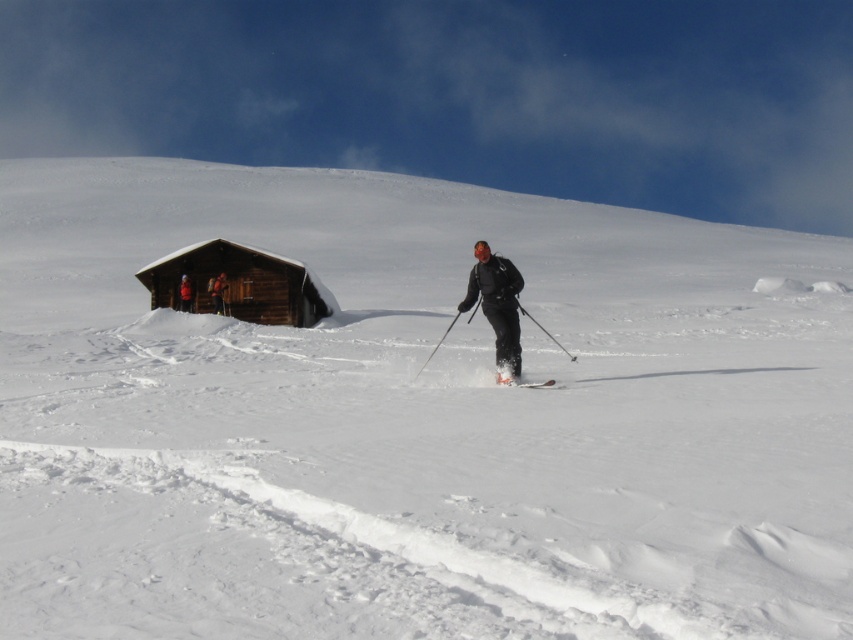
Is point (218, 300) positioned after point (186, 298)?

No, (218, 300) is in front of (186, 298).

Between point (213, 300) and point (183, 294), which one is positioned in front?

Positioned in front is point (183, 294).

Identify the location of orange fabric jacket at left. [218, 291].

Who is positioned more to the left, brown wooden log cabin at upper left or orange fabric jacket at left?

Positioned to the left is brown wooden log cabin at upper left.

Does brown wooden log cabin at upper left lie behind orange fabric jacket at left?

Yes, it is behind orange fabric jacket at left.

Which is in front, point (251, 257) or point (210, 285)?

Point (210, 285) is more forward.

Locate an element on the screen. This screenshot has width=853, height=640. brown wooden log cabin at upper left is located at coordinates (238, 284).

In the scene shown: Can you confirm if brown wooden log cabin at upper left is wider than white matte ski at center?

Correct, the width of brown wooden log cabin at upper left exceeds that of white matte ski at center.

Which of these two, brown wooden log cabin at upper left or white matte ski at center, stands shorter?

Standing shorter between the two is white matte ski at center.

This screenshot has height=640, width=853. In order to click on brown wooden log cabin at upper left in this screenshot , I will do `click(238, 284)`.